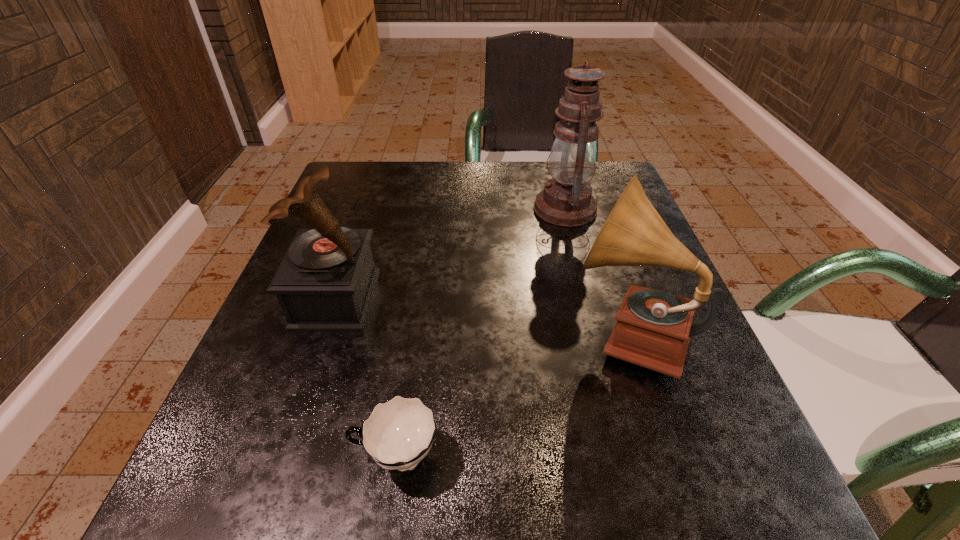
Locate an element on the screen. The height and width of the screenshot is (540, 960). unoccupied area between the tallest object and the right phonograph_record is located at coordinates (596, 271).

Where is `unoccupied area between the cup and the leftmost object`? unoccupied area between the cup and the leftmost object is located at coordinates (366, 377).

Find the location of `free point between the right phonograph_record and the oil lamp`. free point between the right phonograph_record and the oil lamp is located at coordinates (596, 271).

Locate an element on the screen. The width and height of the screenshot is (960, 540). unoccupied position between the right phonograph_record and the shortest object is located at coordinates (512, 395).

Where is `free point between the tallest object and the right phonograph_record`? The width and height of the screenshot is (960, 540). free point between the tallest object and the right phonograph_record is located at coordinates (596, 271).

Find the location of a particular element. The width and height of the screenshot is (960, 540). vacant space that is in between the leftmost object and the tallest object is located at coordinates (450, 254).

The height and width of the screenshot is (540, 960). In order to click on empty location between the nearest object and the oil lamp in this screenshot , I will do `click(481, 333)`.

The image size is (960, 540). I want to click on blank region between the cup and the farthest object, so click(481, 333).

Identify which object is the closest to the farthest object. Please provide its 2D coordinates. Your answer should be formatted as a tuple, i.e. [(x, y)], where the tuple contains the x and y coordinates of a point satisfying the conditions above.

[(653, 329)]

Select which object appears as the third closest to the right phonograph_record. Please provide its 2D coordinates. Your answer should be formatted as a tuple, i.e. [(x, y)], where the tuple contains the x and y coordinates of a point satisfying the conditions above.

[(325, 282)]